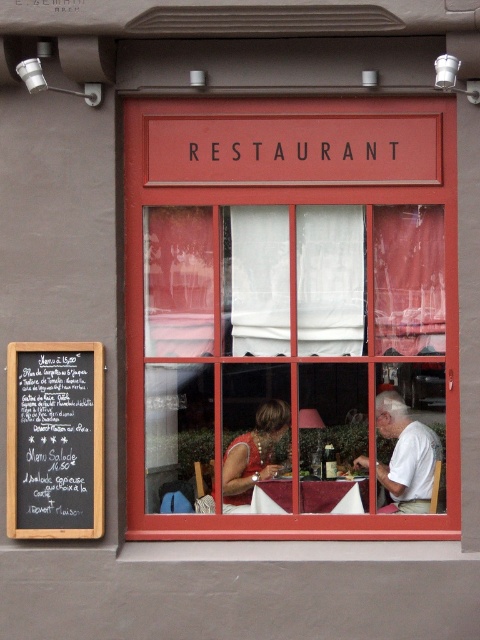
You are standing outside the restaurant and want to enter through the red wooden window at center. The door is 3 feet wide. Can you walk through it?

The red wooden window at center is 25.12 feet from viewer, so it is too far away to walk through. You should look for the entrance door instead.

You are standing outside the restaurant and want to see the menu displayed on the black chalkboard at left. Can you see it through the red wooden window at center?

The red wooden window at center is positioned over the black chalkboard at left, so the window is blocking the view of the chalkboard. You cannot see the menu on the black chalkboard at left through the red wooden window at center.

You are standing outside the restaurant looking at the storefront. The black chalkboard at left is positioned at coordinates 0.689 on the x and 0.115 on the y. If you want to read the chalkboard, should you move to your left or right?

Since the black chalkboard at left is located at point (55, 440), you should move to your left to read it.